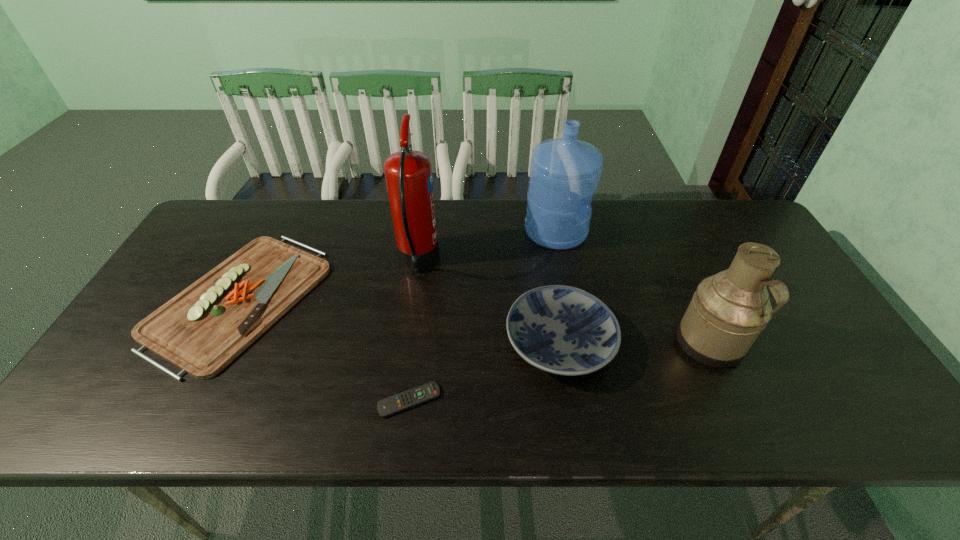
You are a GUI agent. You are given a task and a screenshot of the screen. Output one action in this format:
    pyautogui.click(x=<x>, y=<y>)
    Task: Click on the free space located on the back of the rightmost object
    
    Given the screenshot: What is the action you would take?
    pyautogui.click(x=690, y=300)

Locate an element on the screen. free space located 0.330m on the right of the third shortest object is located at coordinates (748, 343).

Where is `vacant space located on the back of the leftmost object`? The width and height of the screenshot is (960, 540). vacant space located on the back of the leftmost object is located at coordinates (290, 202).

Where is `free space located 0.260m on the left of the shortest object`? free space located 0.260m on the left of the shortest object is located at coordinates (262, 400).

I want to click on fire extinguisher located in the far edge section of the desktop, so coord(408,173).

Find the location of `water jug that is at the far edge`. water jug that is at the far edge is located at coordinates (564, 172).

You are a GUI agent. You are given a task and a screenshot of the screen. Output one action in this format:
    pyautogui.click(x=<x>, y=<y>)
    Task: Click on the chopping board at the far edge
    The height and width of the screenshot is (540, 960).
    Given the screenshot: What is the action you would take?
    pyautogui.click(x=201, y=330)

Where is `object located at the near edge`? Image resolution: width=960 pixels, height=540 pixels. object located at the near edge is located at coordinates (391, 405).

Where is `object that is at the left edge`? object that is at the left edge is located at coordinates (201, 330).

I want to click on object at the far left corner, so click(x=201, y=330).